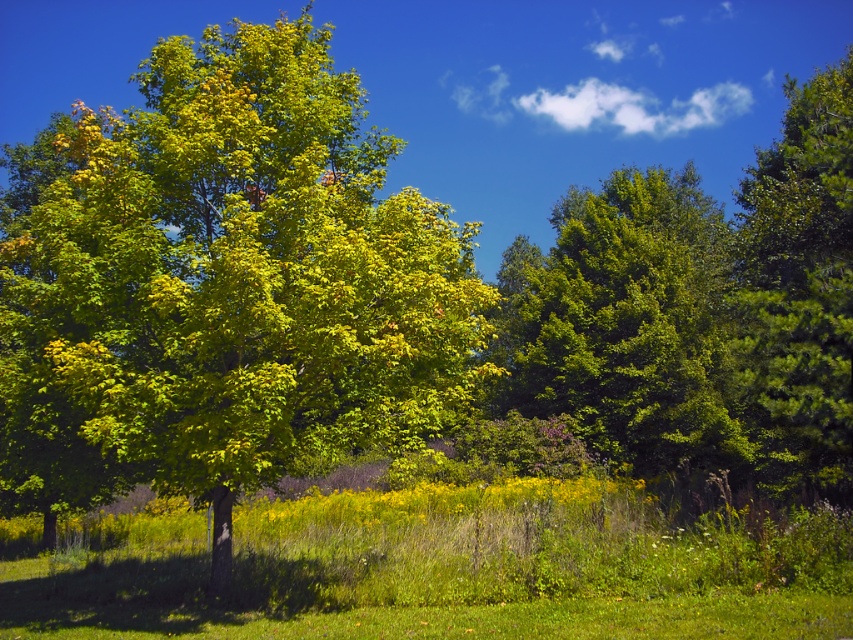
Does green leafy tree at center appear under green matte tree at right?

Correct, green leafy tree at center is located below green matte tree at right.

Does green leafy tree at center appear on the right side of green matte tree at right?

Incorrect, green leafy tree at center is not on the right side of green matte tree at right.

Measure the distance between point (384,385) and camera.

The distance of point (384,385) from camera is 32.55 feet.

What are the coordinates of `green leafy tree at center` in the screenshot? It's located at (222, 285).